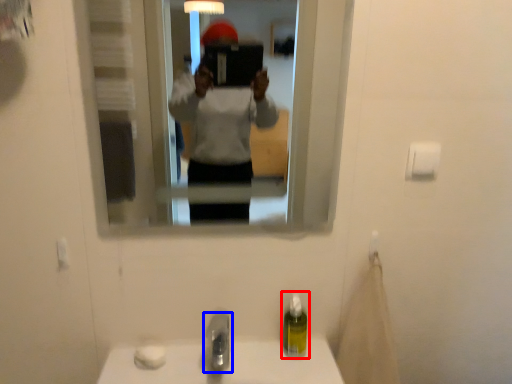
Question: Which point is closer to the camera, soap dispenser (highlighted by a red box) or tap (highlighted by a blue box)?

Choices:
 (A) soap dispenser
 (B) tap

Answer: (B)